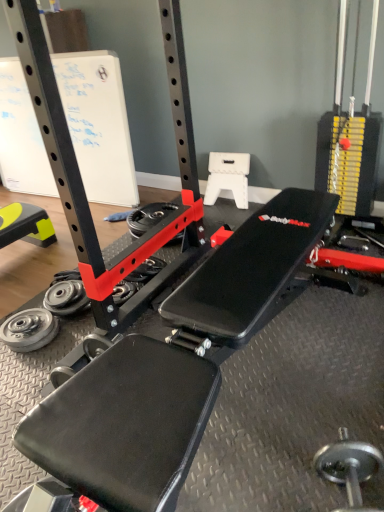
Question: Can you confirm if white paperboard at upper left is wider than silver metallic weight at lower left, acting as the second wheel starting from the bottom?

Choices:
 (A) yes
 (B) no

Answer: (A)

Question: Is white paperboard at upper left shorter than silver metallic weight at lower left, marked as the 2th wheel in a left-to-right arrangement?

Choices:
 (A) yes
 (B) no

Answer: (B)

Question: From a real-world perspective, is white paperboard at upper left over silver metallic weight at lower left, marked as the 2th wheel in a left-to-right arrangement?

Choices:
 (A) no
 (B) yes

Answer: (B)

Question: Would you say white paperboard at upper left is outside silver metallic weight at lower left, which ranks as the 2th wheel in back-to-front order?

Choices:
 (A) yes
 (B) no

Answer: (A)

Question: From a real-world perspective, does white paperboard at upper left sit lower than silver metallic weight at lower left, acting as the second wheel starting from the bottom?

Choices:
 (A) no
 (B) yes

Answer: (A)

Question: In the image, is yellow rubber mat at lower left on the left side or the right side of red plastic wheel at center, the 3th wheel when ordered from bottom to top?

Choices:
 (A) left
 (B) right

Answer: (A)

Question: Does point (14, 212) appear closer or farther from the camera than point (173, 208)?

Choices:
 (A) closer
 (B) farther

Answer: (A)

Question: Is yellow rubber mat at lower left inside the boundaries of red plastic wheel at center, the third wheel viewed from the front, or outside?

Choices:
 (A) outside
 (B) inside

Answer: (A)

Question: In terms of width, does yellow rubber mat at lower left look wider or thinner when compared to red plastic wheel at center, the first wheel when ordered from top to bottom?

Choices:
 (A) wide
 (B) thin

Answer: (A)

Question: Which is correct: red plastic wheel at center, positioned as the 1th wheel in right-to-left order, is inside white paperboard at upper left, or outside of it?

Choices:
 (A) outside
 (B) inside

Answer: (A)

Question: Based on their sizes in the image, would you say red plastic wheel at center, the 3th wheel when ordered from bottom to top, is bigger or smaller than white paperboard at upper left?

Choices:
 (A) small
 (B) big

Answer: (A)

Question: In the image, is red plastic wheel at center, which ranks as the 1th wheel in back-to-front order, positioned in front of or behind white paperboard at upper left?

Choices:
 (A) front
 (B) behind

Answer: (A)

Question: Would you say red plastic wheel at center, which ranks as the 1th wheel in back-to-front order, is to the left or to the right of white paperboard at upper left in the picture?

Choices:
 (A) left
 (B) right

Answer: (B)

Question: Which is correct: yellow rubber mat at lower left is inside white paperboard at upper left, or outside of it?

Choices:
 (A) outside
 (B) inside

Answer: (A)

Question: In terms of height, does yellow rubber mat at lower left look taller or shorter compared to white paperboard at upper left?

Choices:
 (A) tall
 (B) short

Answer: (B)